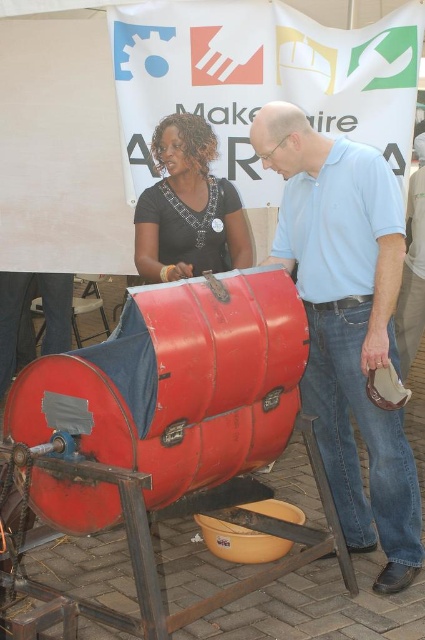
Is light blue shirt at center below matte black shirt at upper left?

Yes, light blue shirt at center is below matte black shirt at upper left.

Between point (311, 244) and point (204, 124), which one is positioned in front?

Positioned in front is point (311, 244).

Image resolution: width=425 pixels, height=640 pixels. In order to click on light blue shirt at center in this screenshot , I will do [348, 323].